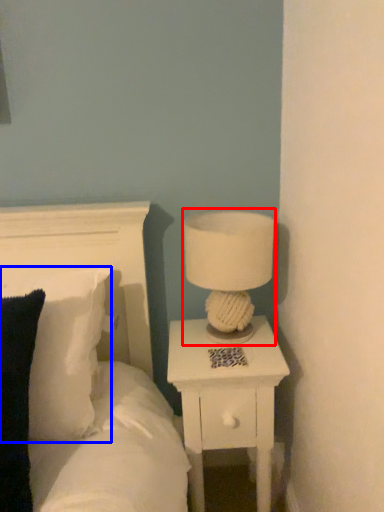
Question: Among these objects, which one is nearest to the camera, table lamp (highlighted by a red box) or pillow (highlighted by a blue box)?

Choices:
 (A) table lamp
 (B) pillow

Answer: (B)